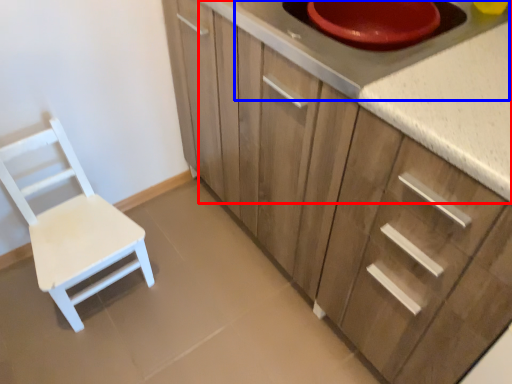
Question: Which object is further to the camera taking this photo, countertop (highlighted by a red box) or appliance (highlighted by a blue box)?

Choices:
 (A) countertop
 (B) appliance

Answer: (B)